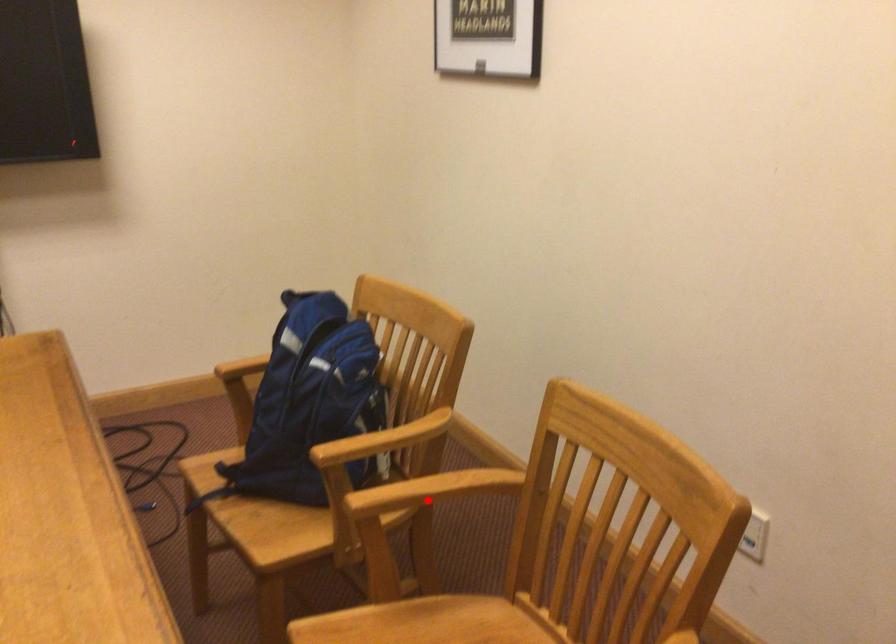
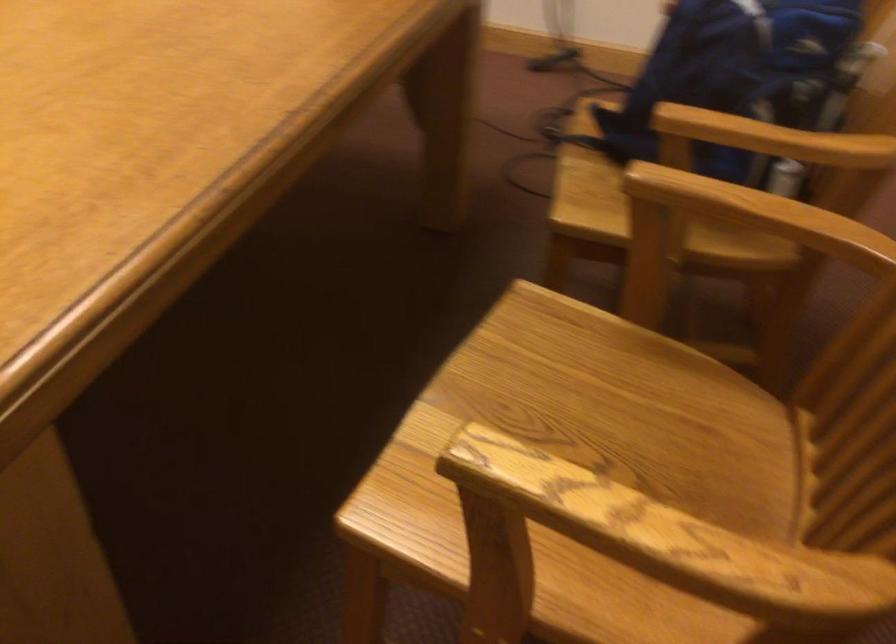
Locate, in the second image, the point that corresponds to the highlighted location in the first image.

(743, 223)